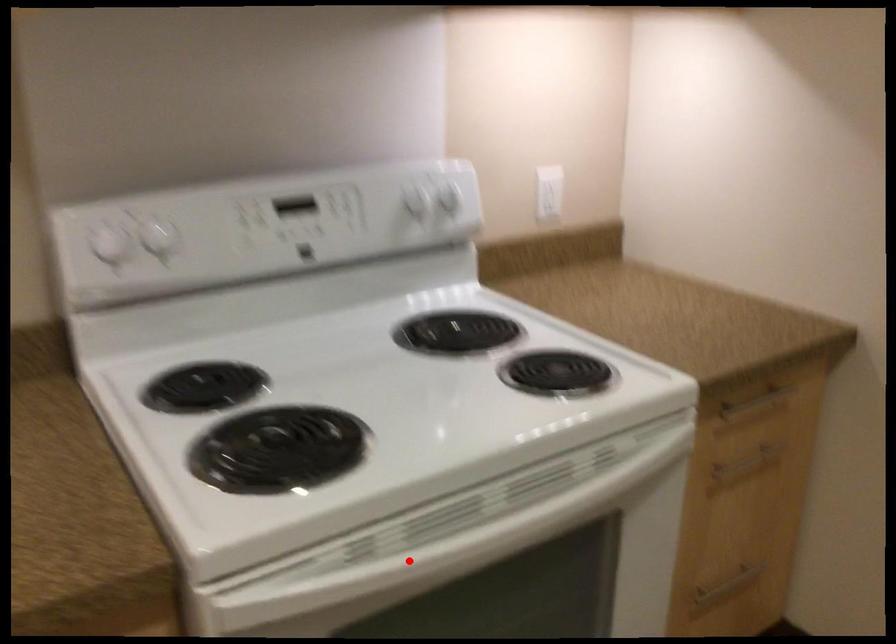
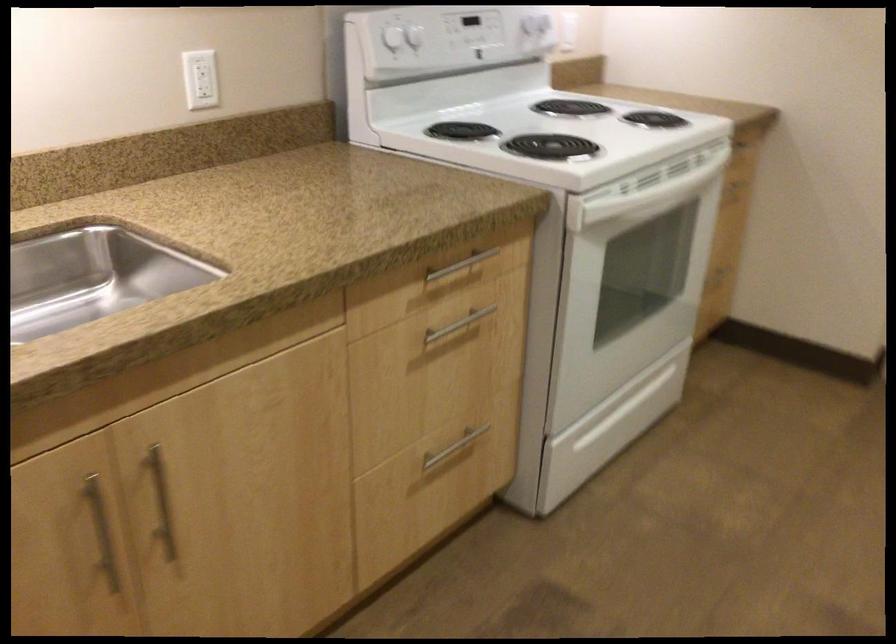
Where in the second image is the point corresponding to the highlighted location from the first image?

(645, 196)